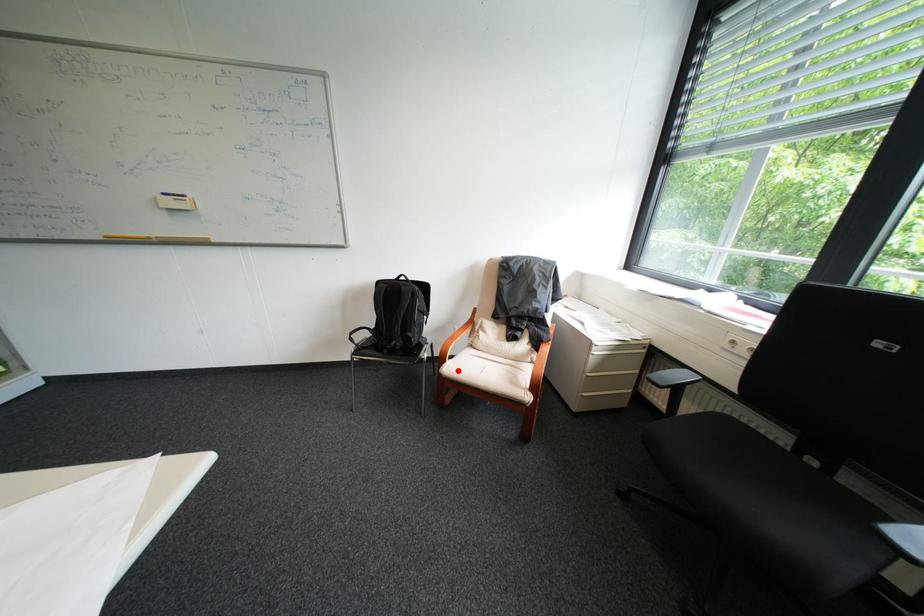
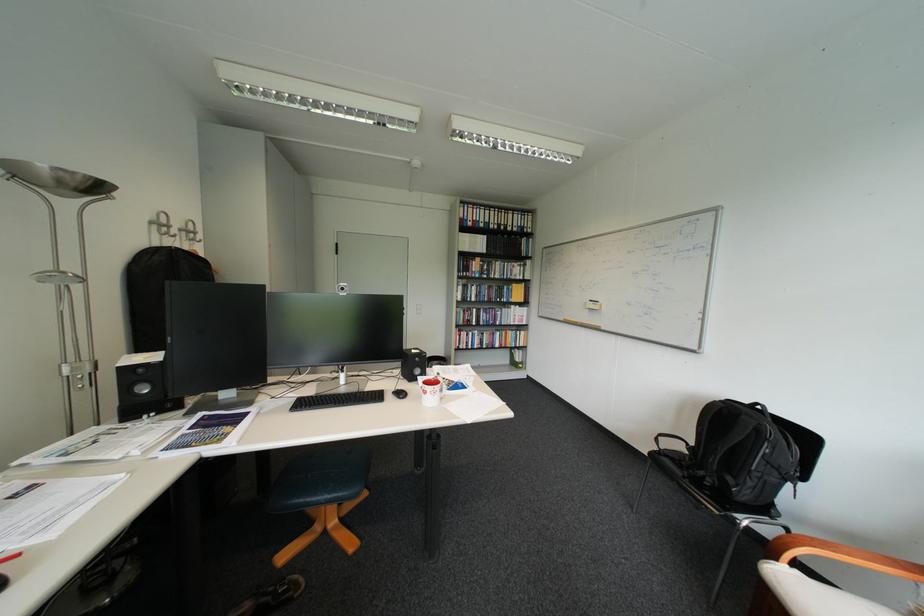
Where in the second image is the point corresponding to the highlighted location from the first image?

(783, 572)